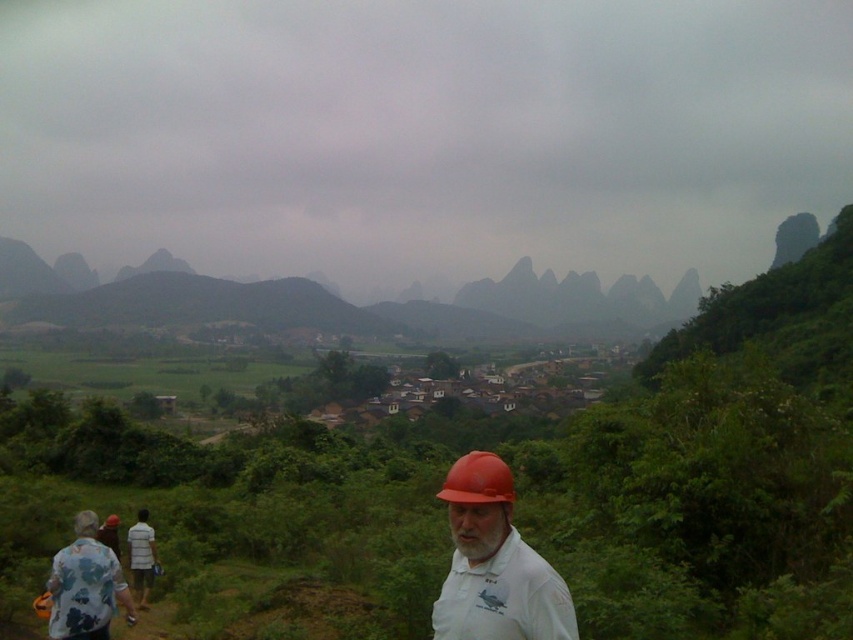
What do you see at coordinates (347, 304) in the screenshot? I see `green matte mountains at upper center` at bounding box center [347, 304].

This screenshot has height=640, width=853. Identify the location of green matte mountains at upper center. (x=347, y=304).

Does point (323, 312) come closer to viewer compared to point (492, 502)?

No, (323, 312) is behind (492, 502).

You are a GUI agent. You are given a task and a screenshot of the screen. Output one action in this format:
    pyautogui.click(x=<x>, y=<y>)
    Task: Click on the green matte mountains at upper center
    The height and width of the screenshot is (640, 853).
    Given the screenshot: What is the action you would take?
    point(347,304)

Which of these two, matte orange hard hat at lower center or white cotton shirt at lower left, stands taller?

With more height is matte orange hard hat at lower center.

Does point (454, 593) lie in front of point (134, 592)?

Yes, it is.

Does point (488, 573) come closer to viewer compared to point (154, 552)?

Yes.

You are a GUI agent. You are given a task and a screenshot of the screen. Output one action in this format:
    pyautogui.click(x=<x>, y=<y>)
    Task: Click on the matte orange hard hat at lower center
    
    Given the screenshot: What is the action you would take?
    pyautogui.click(x=494, y=563)

Who is more forward, (x=524, y=332) or (x=142, y=560)?

Point (x=142, y=560) is more forward.

Is green matte mountains at upper center above white cotton shirt at lower left?

Indeed, green matte mountains at upper center is positioned over white cotton shirt at lower left.

Which is behind, point (610, 317) or point (142, 525)?

Positioned behind is point (610, 317).

Image resolution: width=853 pixels, height=640 pixels. Find the location of `green matte mountains at upper center`. green matte mountains at upper center is located at coordinates click(347, 304).